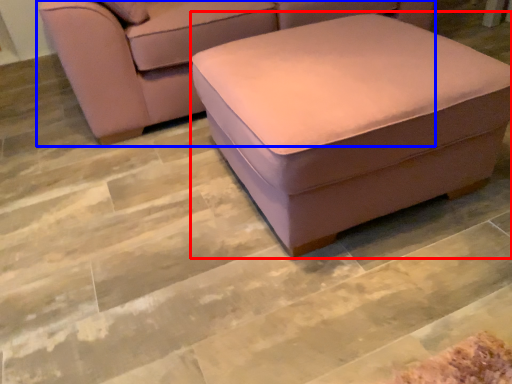
Question: Which object is further to the camera taking this photo, stool (highlighted by a red box) or studio couch (highlighted by a blue box)?

Choices:
 (A) stool
 (B) studio couch

Answer: (B)